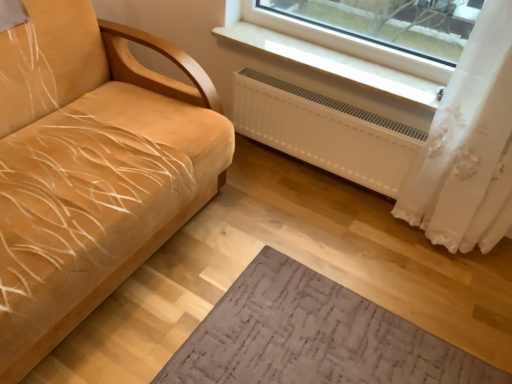
Question: Can we say white matte radiator at lower center lies outside white plastic radiator at upper center?

Choices:
 (A) no
 (B) yes

Answer: (B)

Question: Is white matte radiator at lower center next to white plastic radiator at upper center and touching it?

Choices:
 (A) no
 (B) yes

Answer: (A)

Question: From a real-world perspective, does white matte radiator at lower center sit lower than white plastic radiator at upper center?

Choices:
 (A) yes
 (B) no

Answer: (A)

Question: Can you confirm if white matte radiator at lower center is taller than white plastic radiator at upper center?

Choices:
 (A) yes
 (B) no

Answer: (A)

Question: Does white matte radiator at lower center appear on the left side of white plastic radiator at upper center?

Choices:
 (A) no
 (B) yes

Answer: (B)

Question: From a real-world perspective, is velvet yellow couch at left physically located above or below white plastic radiator at upper center?

Choices:
 (A) above
 (B) below

Answer: (B)

Question: Based on their positions, is velvet yellow couch at left located to the left or right of white plastic radiator at upper center?

Choices:
 (A) right
 (B) left

Answer: (B)

Question: From the image's perspective, is velvet yellow couch at left above or below white plastic radiator at upper center?

Choices:
 (A) above
 (B) below

Answer: (B)

Question: Considering the positions of velvet yellow couch at left and white plastic radiator at upper center in the image, is velvet yellow couch at left wider or thinner than white plastic radiator at upper center?

Choices:
 (A) wide
 (B) thin

Answer: (A)

Question: Considering the positions of white plastic radiator at upper center and white sheer curtain at right in the image, is white plastic radiator at upper center bigger or smaller than white sheer curtain at right?

Choices:
 (A) big
 (B) small

Answer: (B)

Question: Considering their positions, is white plastic radiator at upper center located in front of or behind white sheer curtain at right?

Choices:
 (A) behind
 (B) front

Answer: (A)

Question: From a real-world perspective, is white plastic radiator at upper center above or below white sheer curtain at right?

Choices:
 (A) above
 (B) below

Answer: (A)

Question: From the image's perspective, is white plastic radiator at upper center located above or below white sheer curtain at right?

Choices:
 (A) above
 (B) below

Answer: (A)

Question: Relative to velvet yellow couch at left, is white plastic radiator at upper center in front or behind?

Choices:
 (A) front
 (B) behind

Answer: (B)

Question: From a real-world perspective, is white plastic radiator at upper center physically located above or below velvet yellow couch at left?

Choices:
 (A) above
 (B) below

Answer: (A)